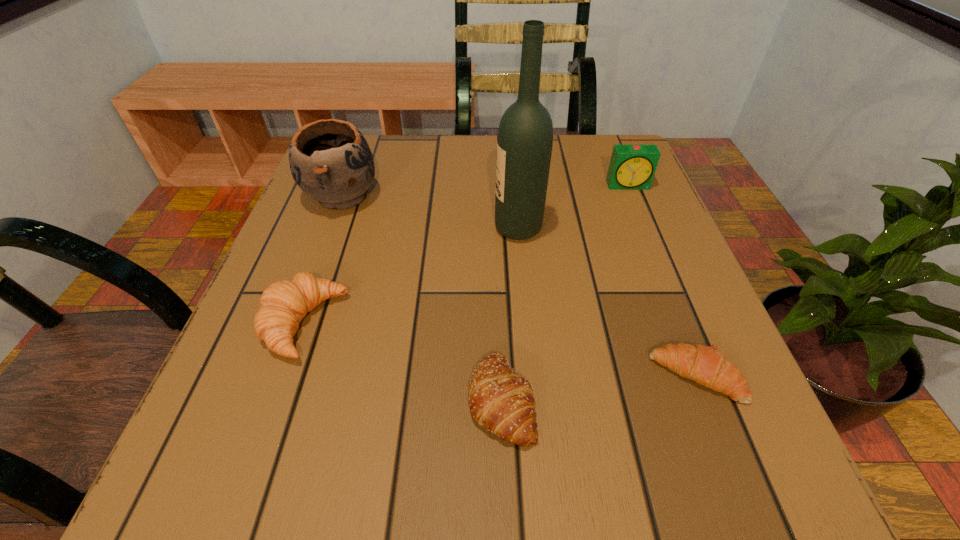
This screenshot has width=960, height=540. I want to click on vacant space located on the right of the second tallest object, so click(x=474, y=197).

Identify the location of free location located 0.390m on the front-facing side of the alarm clock. This screenshot has width=960, height=540. (690, 339).

You are a GUI agent. You are given a task and a screenshot of the screen. Output one action in this format:
    pyautogui.click(x=<x>, y=<y>)
    Task: Click on the vacant space located 0.190m on the front of the leftmost crescent roll
    The height and width of the screenshot is (540, 960).
    Given the screenshot: What is the action you would take?
    pyautogui.click(x=240, y=507)

Locate an element on the screen. vacant space located on the left of the second crescent roll from left to right is located at coordinates (250, 400).

Image resolution: width=960 pixels, height=540 pixels. In order to click on free space located 0.150m on the back of the shortest object in this screenshot , I will do `click(659, 278)`.

In order to click on pottery that is positioned at the far edge in this screenshot , I will do `click(330, 160)`.

The width and height of the screenshot is (960, 540). I want to click on alarm clock that is at the far edge, so click(x=632, y=167).

In order to click on object present at the near edge in this screenshot , I will do `click(502, 402)`.

Locate an element on the screen. pottery at the left edge is located at coordinates click(x=330, y=160).

You are a GUI agent. You are given a task and a screenshot of the screen. Output one action in this format:
    pyautogui.click(x=<x>, y=<y>)
    Task: Click on the crescent roll present at the left edge
    The width and height of the screenshot is (960, 540).
    Given the screenshot: What is the action you would take?
    pyautogui.click(x=283, y=305)